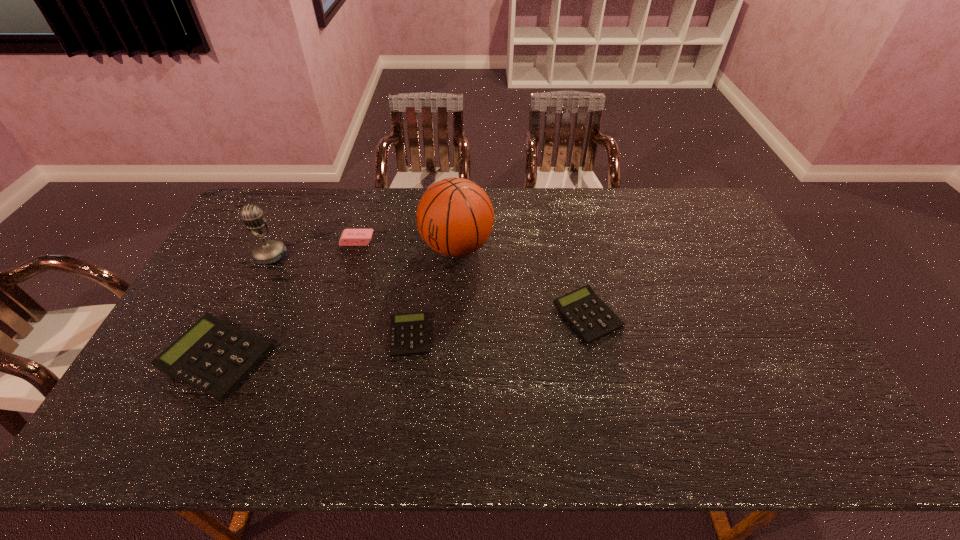
Observe the arrangement of all calculators in the image. To keep them evenly spaced, where would you place another calculator on the right? Please locate a free space. Please provide its 2D coordinates. Your answer should be formatted as a tuple, i.e. [(x, y)], where the tuple contains the x and y coordinates of a point satisfying the conditions above.

[(752, 296)]